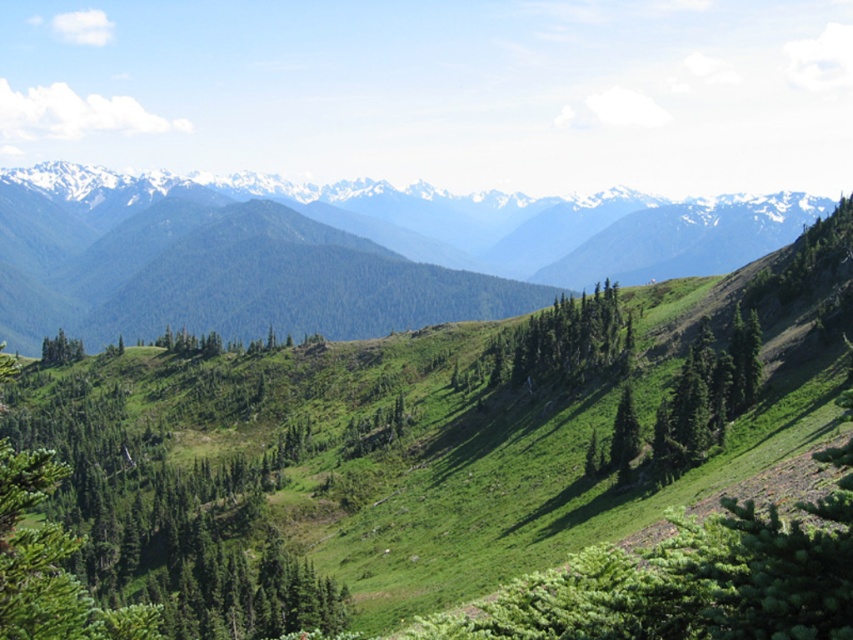
Is green matte tree at center shorter than green matte tree at lower left?

In fact, green matte tree at center may be taller than green matte tree at lower left.

The width and height of the screenshot is (853, 640). What do you see at coordinates (624, 436) in the screenshot? I see `green matte tree at center` at bounding box center [624, 436].

Is point (631, 452) in front of point (44, 339)?

Yes, point (631, 452) is closer to viewer.

Find the location of a particular element. The width and height of the screenshot is (853, 640). green matte tree at center is located at coordinates (624, 436).

Is green grassy hillside at center to the right of green matte tree at lower left from the viewer's perspective?

Indeed, green grassy hillside at center is positioned on the right side of green matte tree at lower left.

What do you see at coordinates (347, 246) in the screenshot? The height and width of the screenshot is (640, 853). I see `green grassy hillside at center` at bounding box center [347, 246].

Between point (260, 314) and point (61, 360), which one is positioned behind?

Positioned behind is point (260, 314).

Find the location of `green grassy hillside at center`. green grassy hillside at center is located at coordinates (347, 246).

How much distance is there between green leafy tree at center and green matte tree at center?

The distance of green leafy tree at center from green matte tree at center is 48.13 meters.

Can you confirm if green leafy tree at center is positioned above green matte tree at center?

Yes, green leafy tree at center is above green matte tree at center.

Between point (595, 300) and point (636, 440), which one is positioned behind?

The point (595, 300) is more distant.

The height and width of the screenshot is (640, 853). I want to click on green leafy tree at center, so click(558, 344).